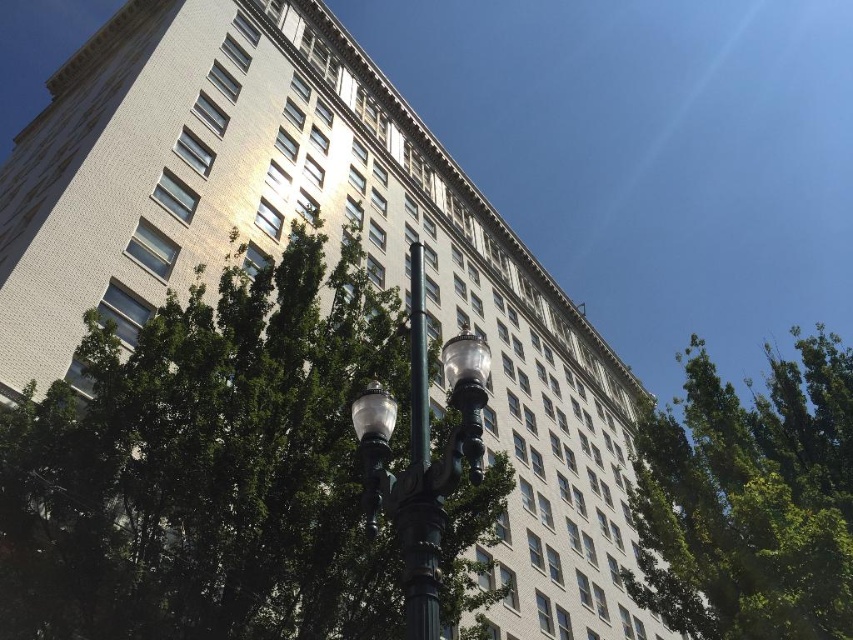
Question: Which point is farther to the camera?

Choices:
 (A) (422, 356)
 (B) (697, 513)

Answer: (B)

Question: Which object is farther from the camera taking this photo?

Choices:
 (A) black metal pole at center
 (B) green leafy tree at upper right
 (C) green leafy tree at center

Answer: (C)

Question: Is green leafy tree at upper right closer to the viewer compared to black metal pole at center?

Choices:
 (A) yes
 (B) no

Answer: (B)

Question: In this image, where is green leafy tree at center located relative to green leafy tree at upper right?

Choices:
 (A) above
 (B) below

Answer: (A)

Question: Can you confirm if green polished metal street light at center is positioned to the left of black metal pole at center?

Choices:
 (A) no
 (B) yes

Answer: (A)

Question: Which object is farther from the camera taking this photo?

Choices:
 (A) green leafy tree at center
 (B) black metal pole at center
 (C) green polished metal street light at center

Answer: (A)